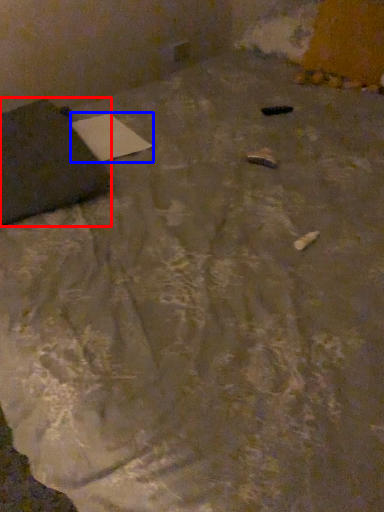
Question: Among these objects, which one is farthest to the camera, furniture (highlighted by a red box) or notepad (highlighted by a blue box)?

Choices:
 (A) furniture
 (B) notepad

Answer: (B)